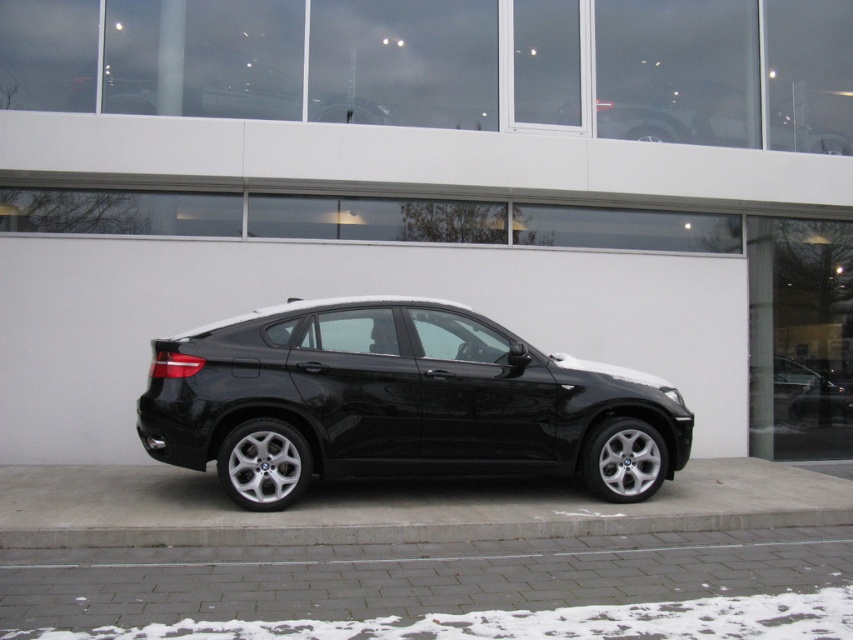
Who is more forward, (502, 408) or (416, 561)?

Positioned in front is point (416, 561).

The image size is (853, 640). Identify the location of black metallic car at center. (399, 403).

This screenshot has height=640, width=853. What are the coordinates of `black metallic car at center` in the screenshot? It's located at (399, 403).

Is gray brick pavement at lower center positioned before concrete at lower center?

Yes, it is.

Does gray brick pavement at lower center appear on the left side of concrete at lower center?

In fact, gray brick pavement at lower center is to the right of concrete at lower center.

Locate an element on the screen. The width and height of the screenshot is (853, 640). gray brick pavement at lower center is located at coordinates (404, 579).

Which is behind, point (194, 436) or point (231, 534)?

The point (194, 436) is more distant.

Is black metallic car at center wider than concrete at lower center?

Yes.

Is point (294, 371) more distant than point (741, 522)?

No, (294, 371) is in front of (741, 522).

In order to click on black metallic car at center in this screenshot , I will do `click(399, 403)`.